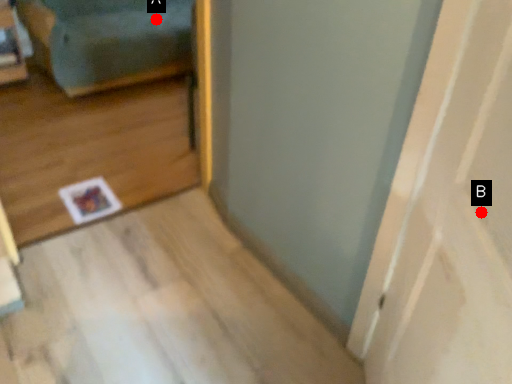
Question: Two points are circled on the image, labeled by A and B beside each circle. Which point is closer to the camera taking this photo?

Choices:
 (A) A is closer
 (B) B is closer

Answer: (B)